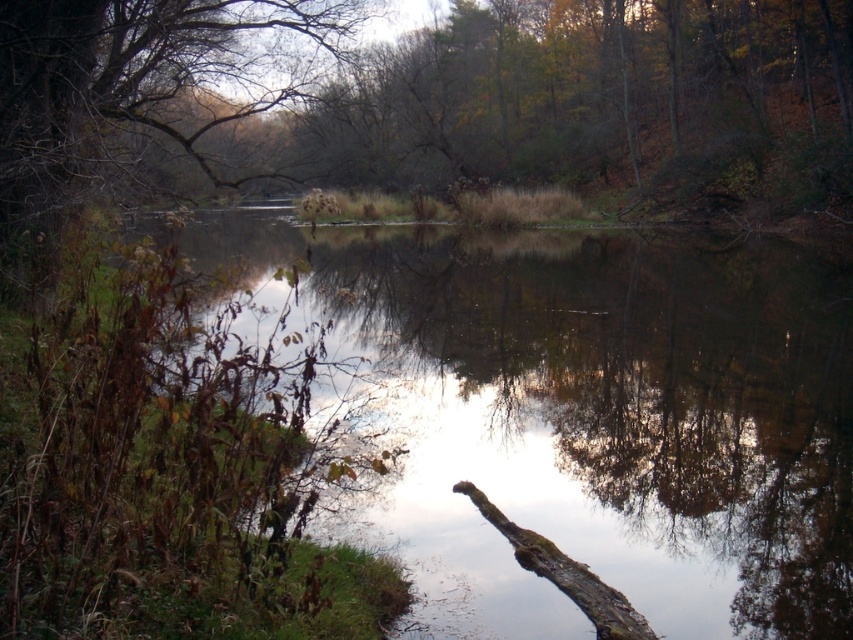
You are an artist sketching the scene and want to ensure accurate proportions. Given the green mossy log at lower left and the brown leafless branches at upper left, which object should you draw first to establish scale in your composition?

The brown leafless branches at upper left should be drawn first because they are larger than the green mossy log at lower left, helping to set the scale for the composition.

You are standing at the edge of the pond and want to place a small decorative rock between the green mossy log at lower left and the brown leafless branches at upper left. Based on their positions, where should you place the rock to ensure it is between them?

The green mossy log at lower left is to the right of the brown leafless branches at upper left. Therefore, to place the rock between them, you should position it somewhere between the right side of the brown leafless branches at upper left and the left side of the green mossy log at lower left.

You are standing at the edge of the water and want to place a small decorative stone on the green mossy log at lower left and the brown rough tree trunk at lower center. Which object is closer to you, allowing you to place the stone without needing to move further into the water?

The green mossy log at lower left is positioned over the brown rough tree trunk at lower center, meaning it is closer to you. Therefore, you can place the stone on the green mossy log at lower left without needing to move further into the water.